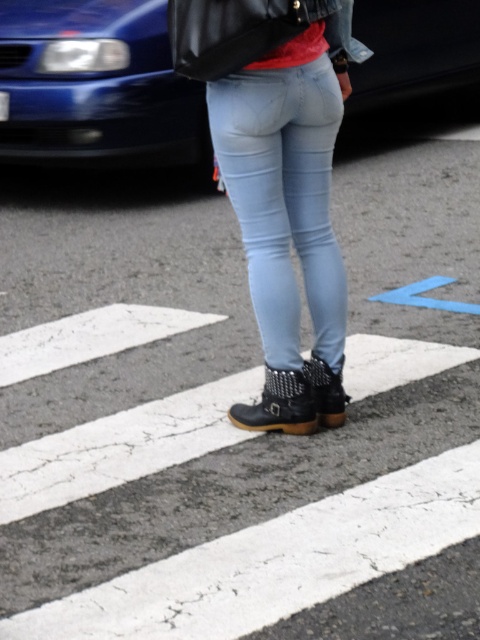
You are a fashion designer observing a pedestrian crossing scene. You notice the light blue denim jeans at center and the leather boots at center. Which clothing item appears bigger in size?

The light blue denim jeans at center has a larger size compared to the leather boots at center, so the light blue denim jeans at center appears bigger in size.

You are a pedestrian trying to cross the street. You see the leather boots at center at point (279, 404). Is the pedestrian crossing directly in front of you or to the side?

The leather boots at center is located at point (279, 404), which is the center of the image. Since the pedestrian crossing is typically in front of the person standing at the crossing, the pedestrian crossing is directly in front of you.